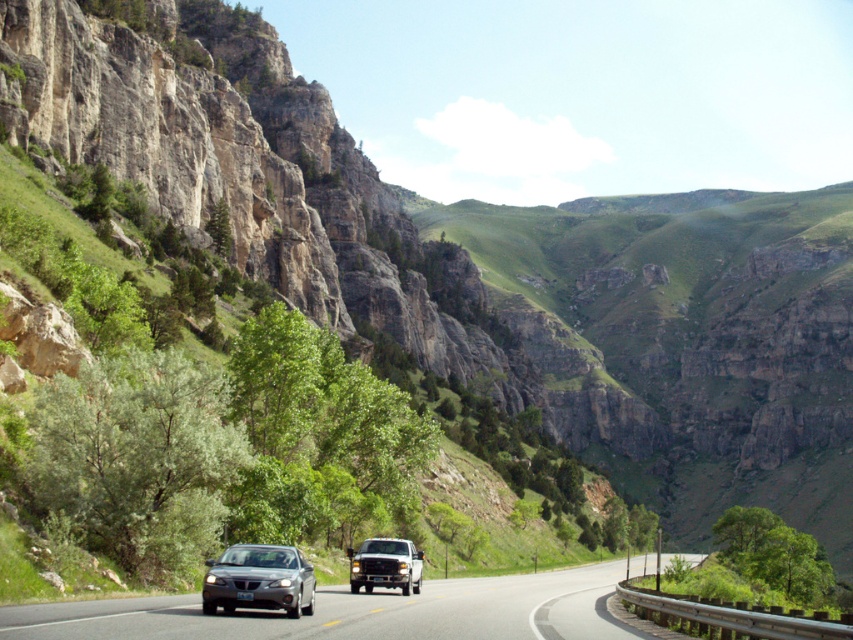
Question: Does silver metallic car at center lie behind matte black truck at center?

Choices:
 (A) yes
 (B) no

Answer: (B)

Question: Which object is the farthest from the satin silver sedan at center?

Choices:
 (A) matte black truck at center
 (B) silver metallic car at center

Answer: (B)

Question: Which of the following is the closest to the observer?

Choices:
 (A) matte black truck at center
 (B) satin silver sedan at center
 (C) silver metallic car at center

Answer: (C)

Question: Can you confirm if silver metallic car at center is bigger than satin silver sedan at center?

Choices:
 (A) no
 (B) yes

Answer: (B)

Question: Which of the following is the closest to the observer?

Choices:
 (A) (550, 608)
 (B) (376, 550)
 (C) (265, 563)

Answer: (C)

Question: Can you confirm if silver metallic car at center is positioned below matte black truck at center?

Choices:
 (A) yes
 (B) no

Answer: (A)